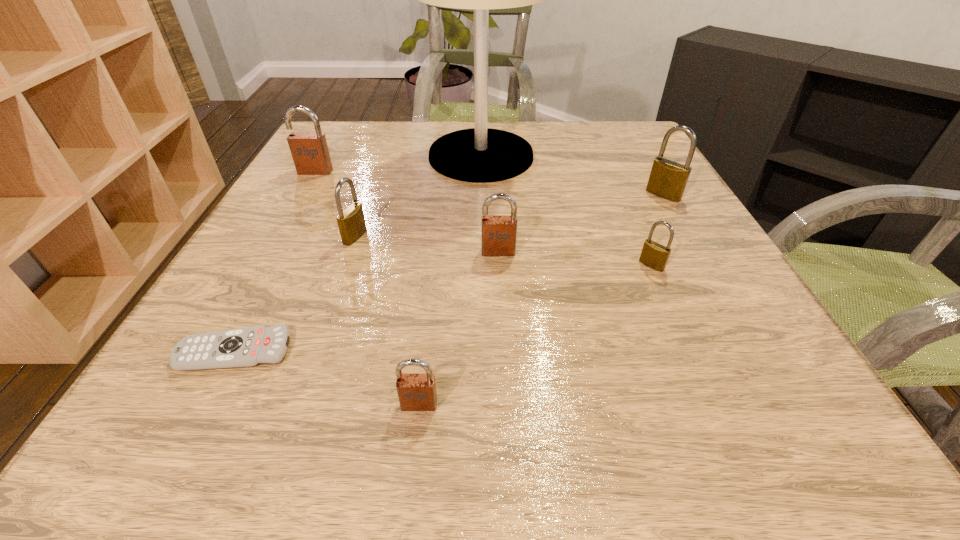
Find the location of a particular element. free space that satisfies the following two spatial constraints: 1. on the front-facing side of the leftmost brass padlock; 2. on the left side of the farthest brown padlock is located at coordinates (278, 237).